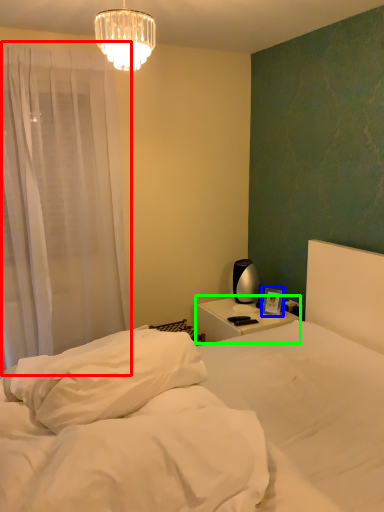
Question: Based on their relative distances, which object is farther from curtain (highlighted by a red box)? Choose from picture frame (highlighted by a blue box) and nightstand (highlighted by a green box).

Choices:
 (A) picture frame
 (B) nightstand

Answer: (A)